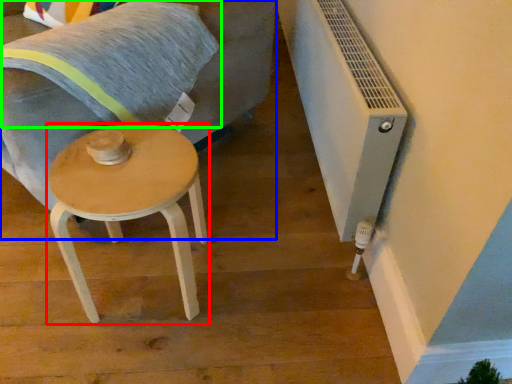
Question: Based on their relative distances, which object is farther from stool (highlighted by a red box)? Choose from swivel chair (highlighted by a blue box) and pillow (highlighted by a green box).

Choices:
 (A) swivel chair
 (B) pillow

Answer: (A)